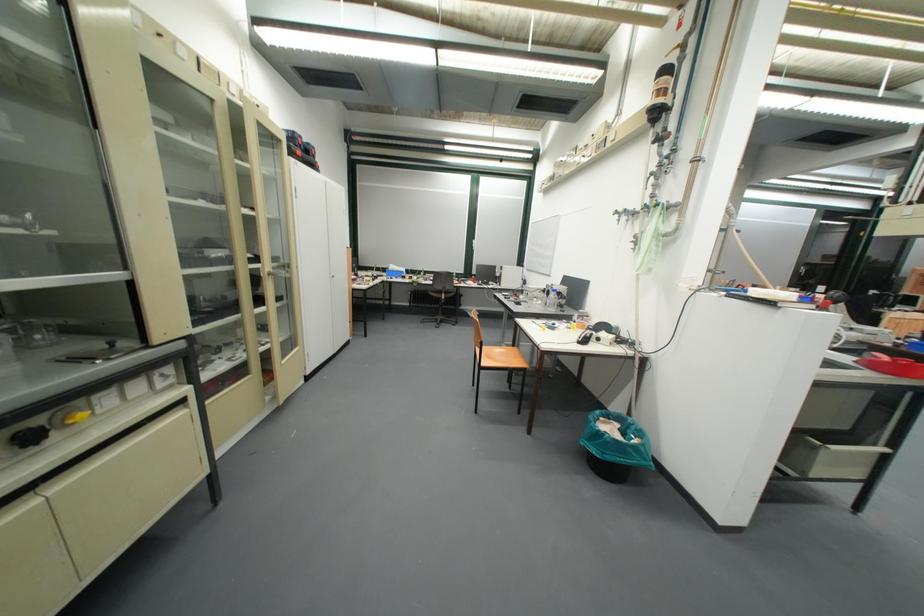
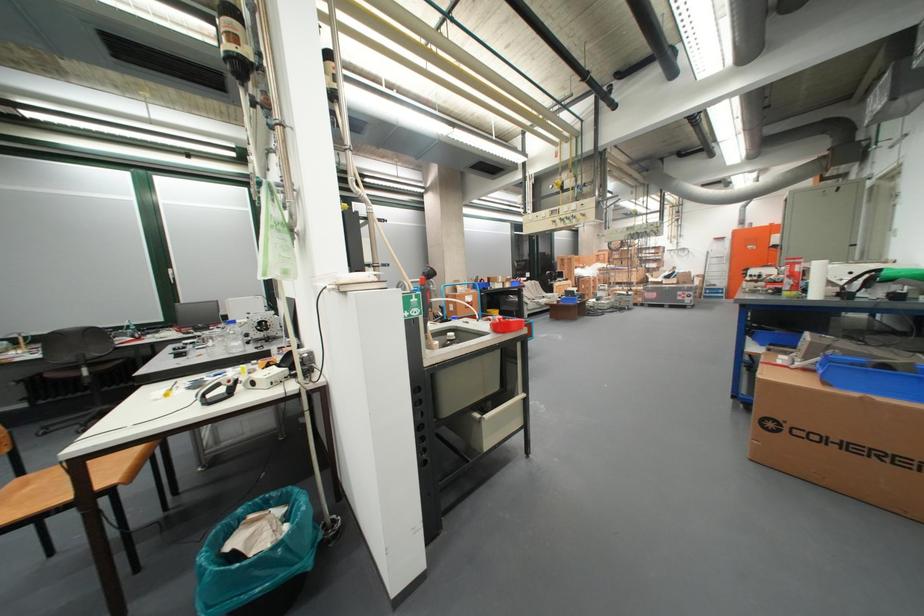
Where in the second image is the point corresponding to point 451,288 from the first image?

(79, 360)